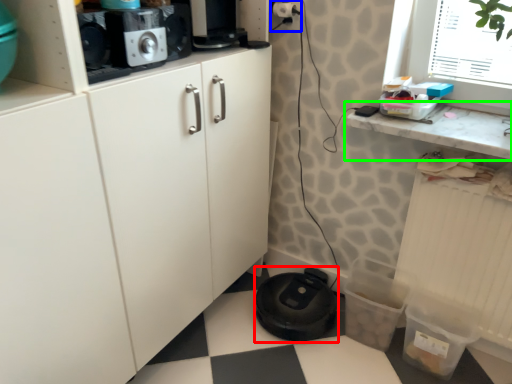
Question: Which object is the closest to the appliance (highlighted by a red box)? Choose among these: electric outlet (highlighted by a blue box) or countertop (highlighted by a green box).

Choices:
 (A) electric outlet
 (B) countertop

Answer: (B)